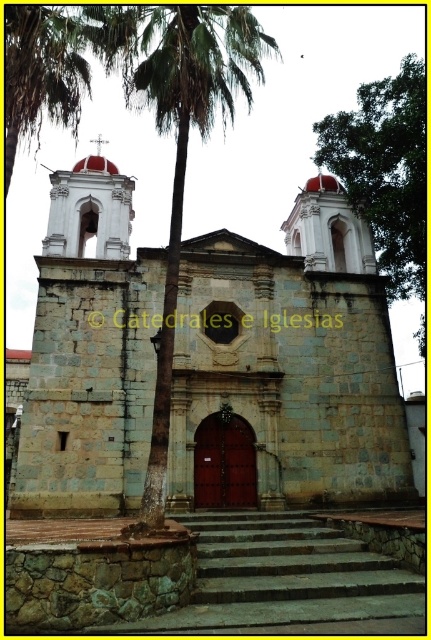
Is stone church at center to the right of green leafy tree at right from the viewer's perspective?

In fact, stone church at center is to the left of green leafy tree at right.

Is point (284, 380) farther from camera compared to point (424, 170)?

That is False.

Image resolution: width=431 pixels, height=640 pixels. What are the coordinates of `stone church at center` in the screenshot? It's located at (287, 368).

Between green leafy palm tree at center and green leafy tree at right, which one appears on the right side from the viewer's perspective?

Positioned to the right is green leafy tree at right.

In order to click on green leafy palm tree at center in this screenshot , I will do `click(177, 134)`.

Identify the location of green leafy palm tree at center. (177, 134).

From the picture: Who is more distant from viewer, (209, 346) or (99, 35)?

Positioned behind is point (209, 346).

Locate an element on the screen. The height and width of the screenshot is (640, 431). stone church at center is located at coordinates (287, 368).

You are a GUI agent. You are given a task and a screenshot of the screen. Output one action in this format:
    pyautogui.click(x=<x>, y=<y>)
    Task: Click on the stone church at center
    The image size is (431, 640).
    Given the screenshot: What is the action you would take?
    pyautogui.click(x=287, y=368)